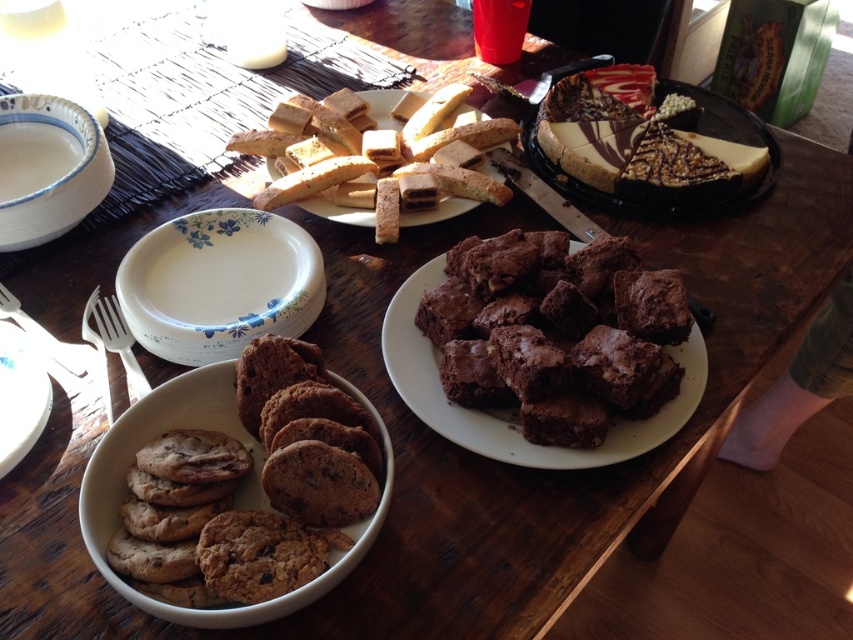
Can you confirm if white ceramic plate at center is taller than matte white plate at lower left?

Yes.

Can you confirm if white ceramic plate at center is positioned below matte white plate at lower left?

No.

What do you see at coordinates (219, 284) in the screenshot? I see `white ceramic plate at center` at bounding box center [219, 284].

You are a GUI agent. You are given a task and a screenshot of the screen. Output one action in this format:
    pyautogui.click(x=<x>, y=<y>)
    Task: Click on the white ceramic plate at center
    This screenshot has height=640, width=853.
    Given the screenshot: What is the action you would take?
    pyautogui.click(x=219, y=284)

Is brown matte bowl at lower left taller than golden brown crumbly biscotti at center?

Incorrect, brown matte bowl at lower left's height is not larger of golden brown crumbly biscotti at center's.

Is point (318, 588) positioned after point (321, 216)?

No.

Is point (178, 376) positioned before point (314, 196)?

Yes.

The height and width of the screenshot is (640, 853). What are the coordinates of `brown matte bowl at lower left` in the screenshot? It's located at (236, 497).

Does matte white plate at lower left have a smaller size compared to golden brown crumbly biscotti at center?

Indeed, matte white plate at lower left has a smaller size compared to golden brown crumbly biscotti at center.

Is point (18, 332) positioned behind point (405, 220)?

No, (18, 332) is closer to viewer.

Locate an element on the screen. This screenshot has width=853, height=640. matte white plate at lower left is located at coordinates (20, 396).